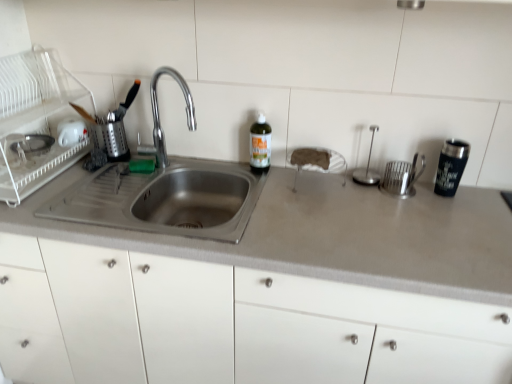
Find the location of a particular element. Image resolution: width=512 pixels, height=384 pixels. vacant space to the left of black stainless steel tumbler at right is located at coordinates (408, 203).